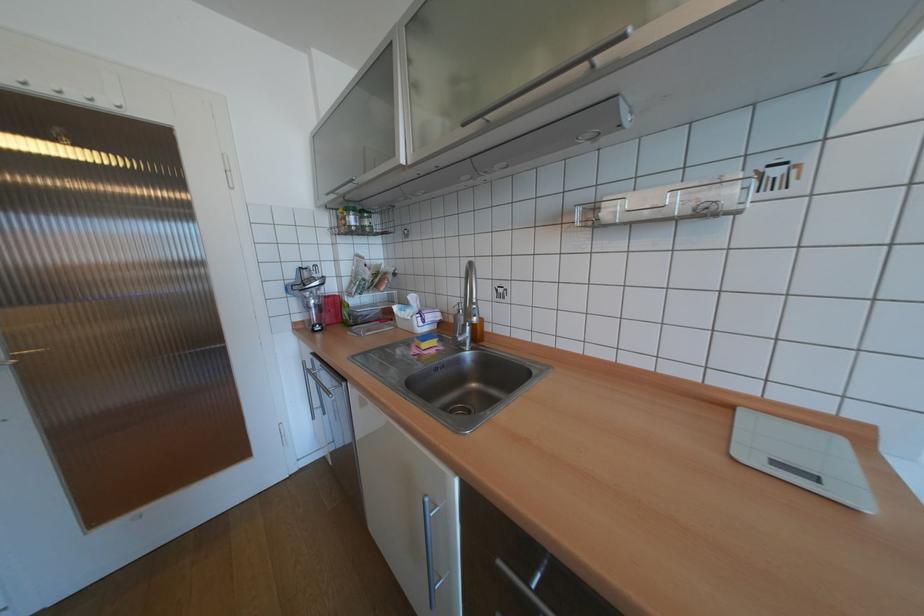
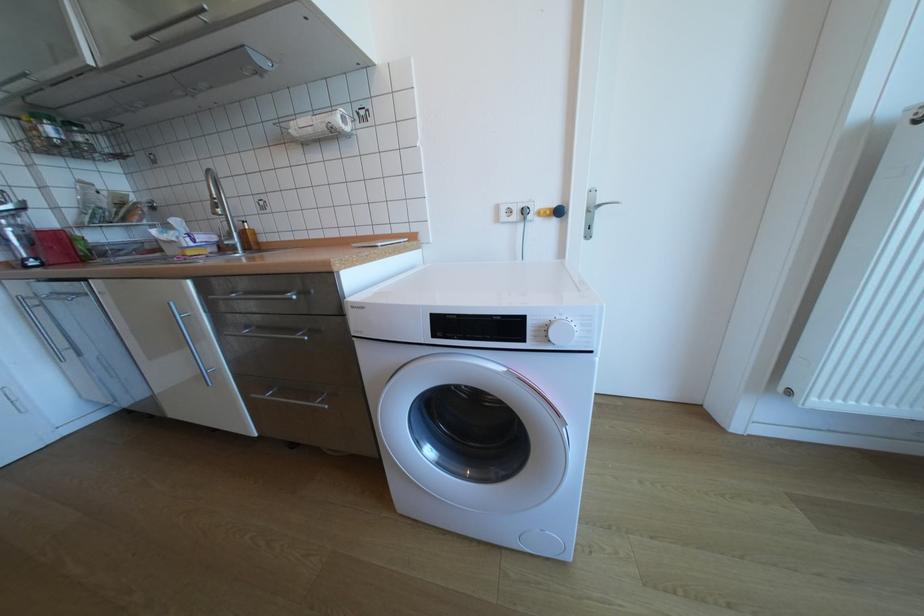
In the second image, find the point that corresponds to point 444,326 in the first image.

(224, 249)